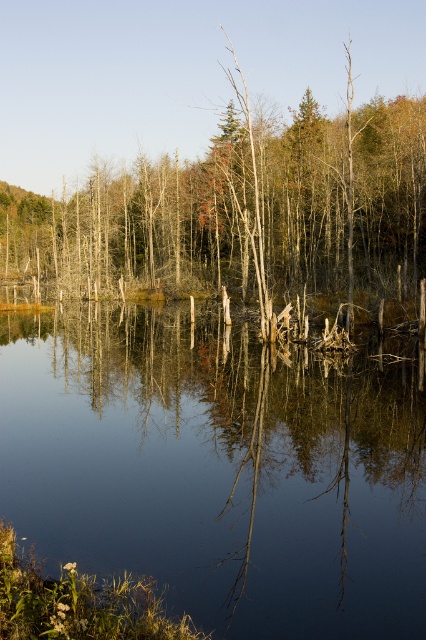
Looking at this image, which of these two, smooth water at center or smooth bark tree at center, stands shorter?

smooth water at center is shorter.

Which is behind, point (195, 464) or point (411, 173)?

The point (411, 173) is more distant.

In order to click on smooth water at center in this screenshot , I will do `click(219, 467)`.